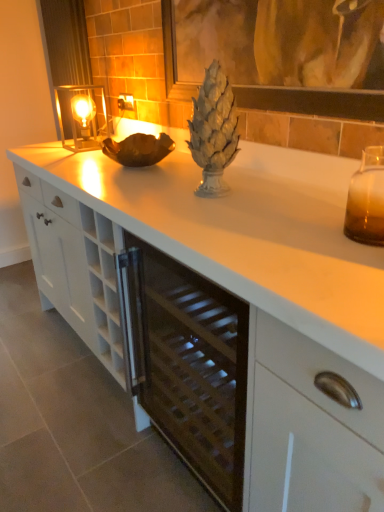
Question: From the image's perspective, does metallic glass candle holder at left, the first candle holder viewed from the left, appear higher than shiny metallic pineapple at center?

Choices:
 (A) no
 (B) yes

Answer: (B)

Question: Does metallic glass candle holder at left, arranged as the 2th candle holder when ordered from the bottom, touch shiny metallic pineapple at center?

Choices:
 (A) no
 (B) yes

Answer: (A)

Question: Is there a large distance between metallic glass candle holder at left, the first candle holder from the top, and shiny metallic pineapple at center?

Choices:
 (A) yes
 (B) no

Answer: (B)

Question: Is metallic glass candle holder at left, arranged as the 2th candle holder when ordered from the bottom, at the right side of shiny metallic pineapple at center?

Choices:
 (A) no
 (B) yes

Answer: (A)

Question: Does metallic glass candle holder at left, the first candle holder viewed from the left, appear on the left side of shiny metallic pineapple at center?

Choices:
 (A) yes
 (B) no

Answer: (A)

Question: From a real-world perspective, is metallic glass candle holder at left, the second candle holder when ordered from front to back, above or below white matte cabinet at center?

Choices:
 (A) below
 (B) above

Answer: (B)

Question: Considering the positions of metallic glass candle holder at left, the first candle holder viewed from the left, and white matte cabinet at center in the image, is metallic glass candle holder at left, the first candle holder viewed from the left, bigger or smaller than white matte cabinet at center?

Choices:
 (A) small
 (B) big

Answer: (A)

Question: In the image, is metallic glass candle holder at left, arranged as the 2th candle holder when ordered from the bottom, positioned in front of or behind white matte cabinet at center?

Choices:
 (A) front
 (B) behind

Answer: (B)

Question: Considering the positions of point (64, 97) and point (306, 380), is point (64, 97) closer or farther from the camera than point (306, 380)?

Choices:
 (A) farther
 (B) closer

Answer: (A)

Question: Is white matte cabinet at center bigger or smaller than matte glass picture frame at upper center?

Choices:
 (A) big
 (B) small

Answer: (A)

Question: Relative to matte glass picture frame at upper center, is white matte cabinet at center in front or behind?

Choices:
 (A) behind
 (B) front

Answer: (B)

Question: Considering the positions of white matte cabinet at center and matte glass picture frame at upper center in the image, is white matte cabinet at center taller or shorter than matte glass picture frame at upper center?

Choices:
 (A) short
 (B) tall

Answer: (B)

Question: Is white matte cabinet at center to the left or to the right of matte glass picture frame at upper center in the image?

Choices:
 (A) left
 (B) right

Answer: (B)

Question: Is point (339, 463) positioned closer to the camera than point (74, 7)?

Choices:
 (A) farther
 (B) closer

Answer: (B)

Question: In the image, is white matte cabinet at center positioned in front of or behind metallic silver curtain at upper left?

Choices:
 (A) front
 (B) behind

Answer: (A)